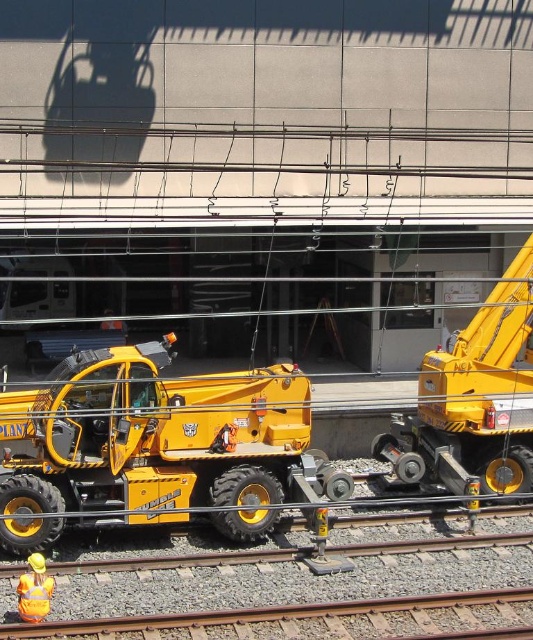
Is yellow rubber crane at center below gray gravel train track at lower center?

No, yellow rubber crane at center is not below gray gravel train track at lower center.

Who is more distant from viewer, (502, 305) or (247, 616)?

Positioned behind is point (502, 305).

This screenshot has height=640, width=533. In order to click on yellow rubber crane at center in this screenshot , I will do `click(473, 400)`.

How far apart are yellow rubber crane at center and reflective yellow vest at lower left?

They are 6.26 meters apart.

Can you confirm if yellow rubber crane at center is positioned to the left of reflective yellow vest at lower left?

Incorrect, yellow rubber crane at center is not on the left side of reflective yellow vest at lower left.

Which is in front, point (494, 362) or point (26, 582)?

Point (26, 582)

Where is `yellow rubber crane at center`? The height and width of the screenshot is (640, 533). yellow rubber crane at center is located at coordinates (473, 400).

This screenshot has height=640, width=533. What do you see at coordinates (154, 444) in the screenshot?
I see `yellow rubber truck at center` at bounding box center [154, 444].

Does yellow rubber truck at center lie behind reflective yellow vest at lower left?

Yes, it is behind reflective yellow vest at lower left.

Who is more distant from viewer, (x=243, y=410) or (x=35, y=556)?

The point (x=243, y=410) is behind.

Find the location of a particular element. yellow rubber truck at center is located at coordinates (154, 444).